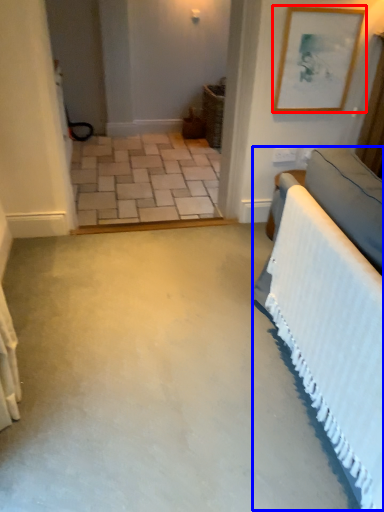
Question: Which object appears closest to the camera in this image, picture frame (highlighted by a red box) or bed (highlighted by a blue box)?

Choices:
 (A) picture frame
 (B) bed

Answer: (B)